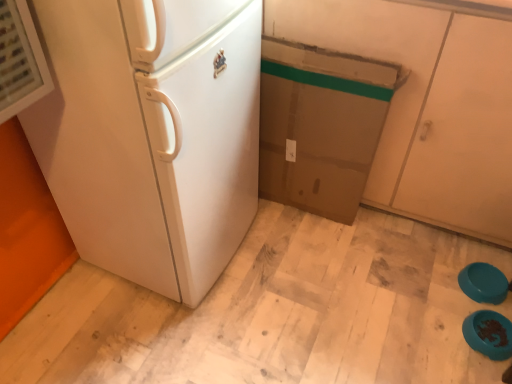
Identify the location of vacant area that lies between teal plastic bowls at lower right, the 2th appliance viewed from the front, and teal glossy bowls at lower right, marked as the 1th appliance in a front-to-back arrangement. (481, 307).